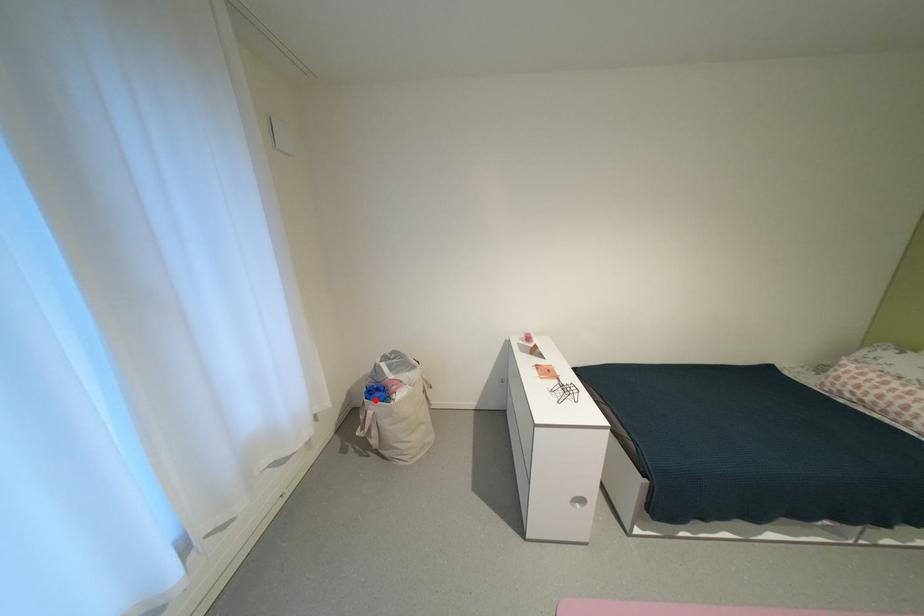
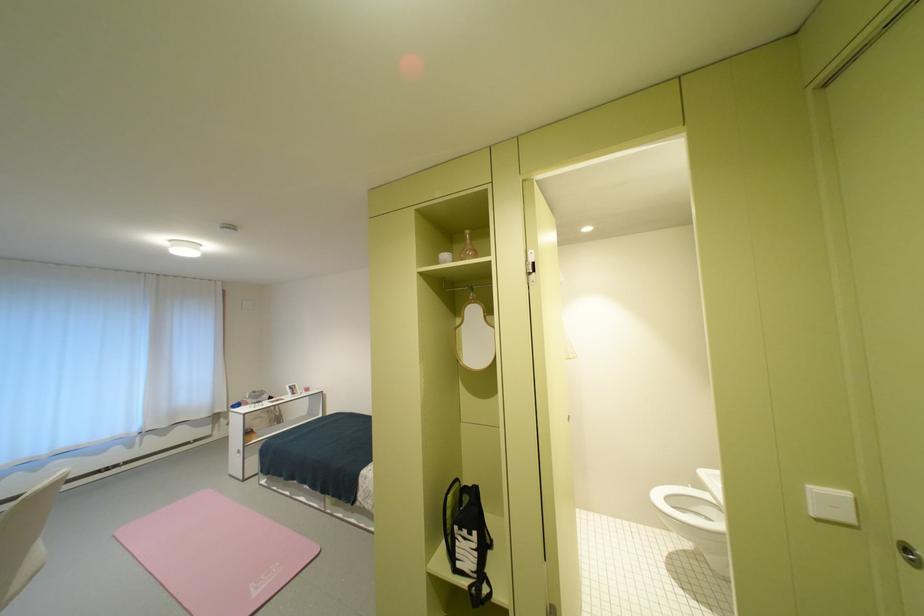
Question: I am providing you with two images of the same scene from different viewpoints. A red point is marked on the first image. At the location where the point appears in image 1, is it still visible in image 2?

Choices:
 (A) Yes
 (B) No

Answer: (B)